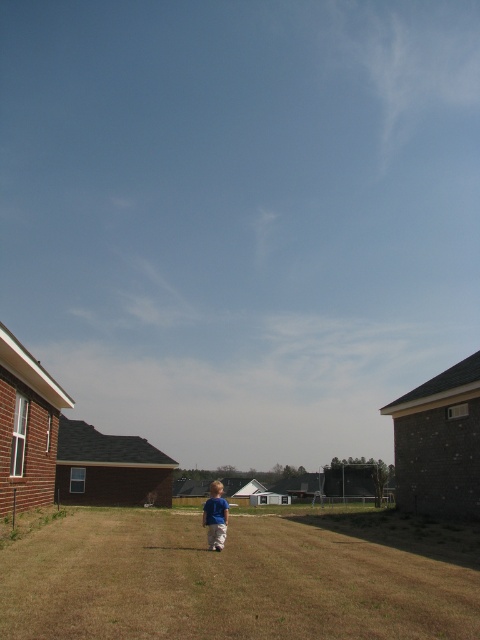
You are a photographer trying to capture a photo of the blue cotton shirt at center without the brown dry grass at center appearing in the frame. Is it possible to adjust your camera angle to achieve this?

The brown dry grass at center is above the blue cotton shirt at center, so lowering the camera angle could prevent the grass from being in the frame while still capturing the shirt.